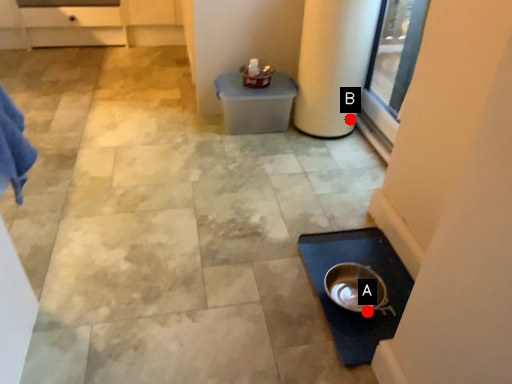
Question: Two points are circled on the image, labeled by A and B beside each circle. Which point is closer to the camera?

Choices:
 (A) A is closer
 (B) B is closer

Answer: (A)